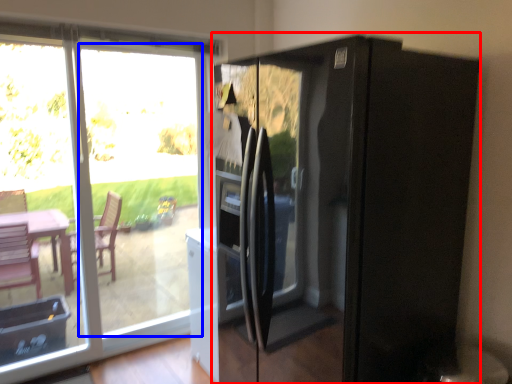
Question: Which object is further to the camera taking this photo, appliance (highlighted by a red box) or glass door (highlighted by a blue box)?

Choices:
 (A) appliance
 (B) glass door

Answer: (B)